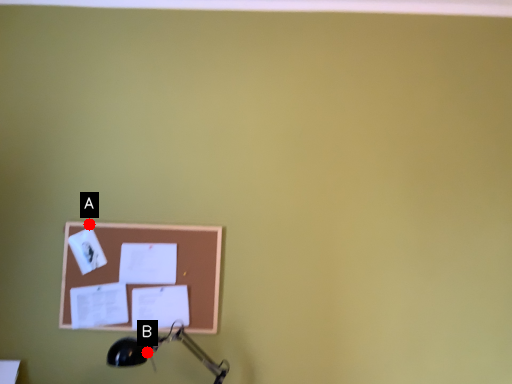
Question: Two points are circled on the image, labeled by A and B beside each circle. Which point is farther to the camera?

Choices:
 (A) A is further
 (B) B is further

Answer: (A)